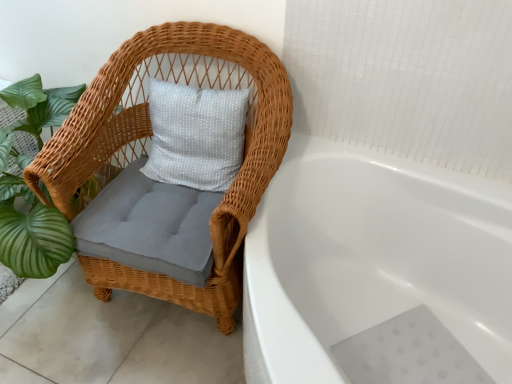
Question: Is woven wicker chair at left behind white glossy bathtub at center?

Choices:
 (A) no
 (B) yes

Answer: (B)

Question: Can we say woven wicker chair at left lies outside white glossy bathtub at center?

Choices:
 (A) no
 (B) yes

Answer: (B)

Question: Does woven wicker chair at left have a smaller size compared to white glossy bathtub at center?

Choices:
 (A) yes
 (B) no

Answer: (A)

Question: From the image's perspective, would you say woven wicker chair at left is shown under white glossy bathtub at center?

Choices:
 (A) no
 (B) yes

Answer: (A)

Question: From a real-world perspective, is woven wicker chair at left located beneath white glossy bathtub at center?

Choices:
 (A) no
 (B) yes

Answer: (A)

Question: Does woven wicker chair at left have a greater width compared to white glossy bathtub at center?

Choices:
 (A) yes
 (B) no

Answer: (B)

Question: Is white glossy bathtub at center facing towards woven wicker chair at left?

Choices:
 (A) yes
 (B) no

Answer: (B)

Question: From a real-world perspective, is white glossy bathtub at center positioned under woven wicker chair at left based on gravity?

Choices:
 (A) yes
 (B) no

Answer: (A)

Question: Is white glossy bathtub at center not close to woven wicker chair at left?

Choices:
 (A) yes
 (B) no

Answer: (B)

Question: From the image's perspective, is white glossy bathtub at center above woven wicker chair at left?

Choices:
 (A) no
 (B) yes

Answer: (A)

Question: Is white glossy bathtub at center taller than woven wicker chair at left?

Choices:
 (A) no
 (B) yes

Answer: (A)

Question: Is the depth of white glossy bathtub at center greater than that of woven wicker chair at left?

Choices:
 (A) no
 (B) yes

Answer: (A)

Question: From the image's perspective, relative to woven wicker chair at left, is white glossy bathtub at center above or below?

Choices:
 (A) below
 (B) above

Answer: (A)